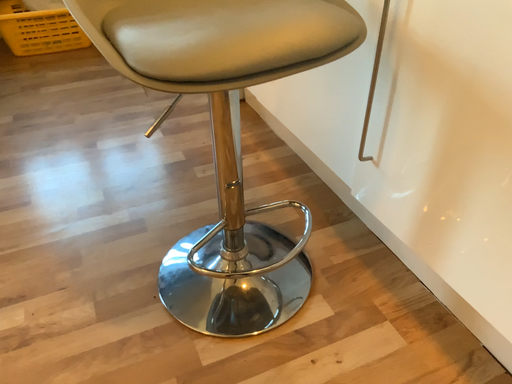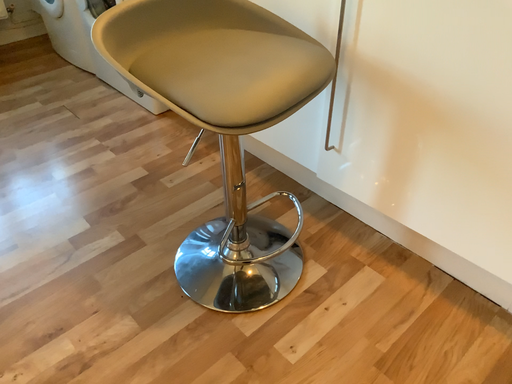
Question: How did the camera likely rotate when shooting the video?

Choices:
 (A) rotated right
 (B) rotated left

Answer: (A)